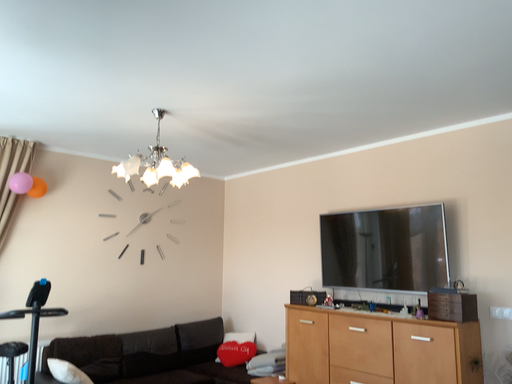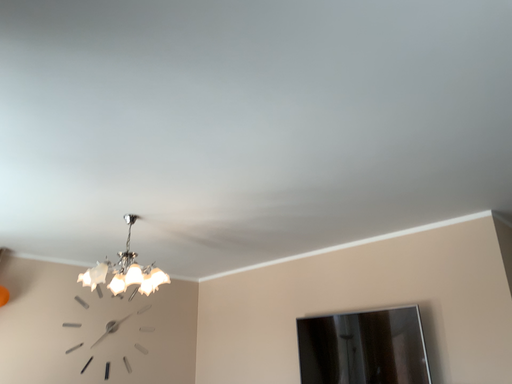
Question: How did the camera likely rotate when shooting the video?

Choices:
 (A) rotated upward
 (B) rotated downward

Answer: (A)